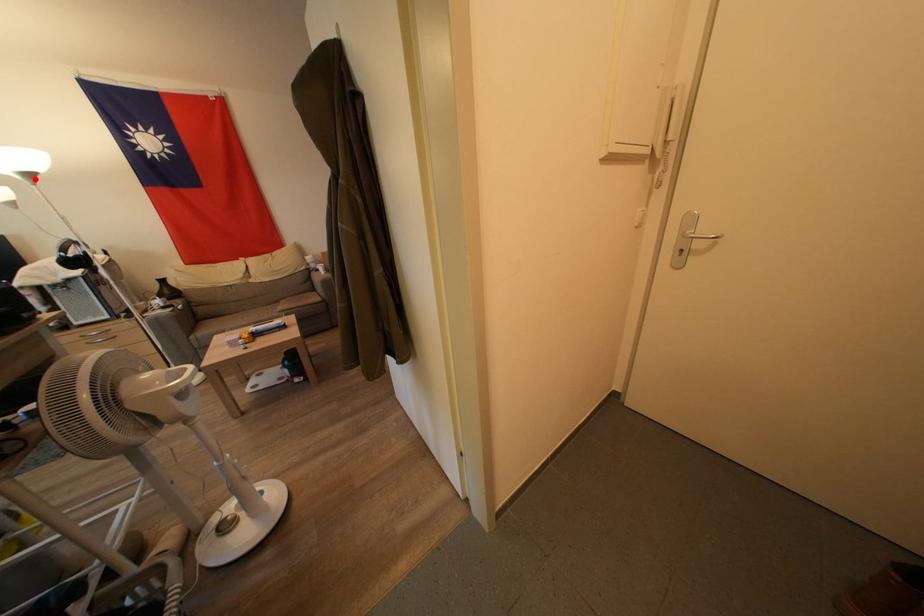
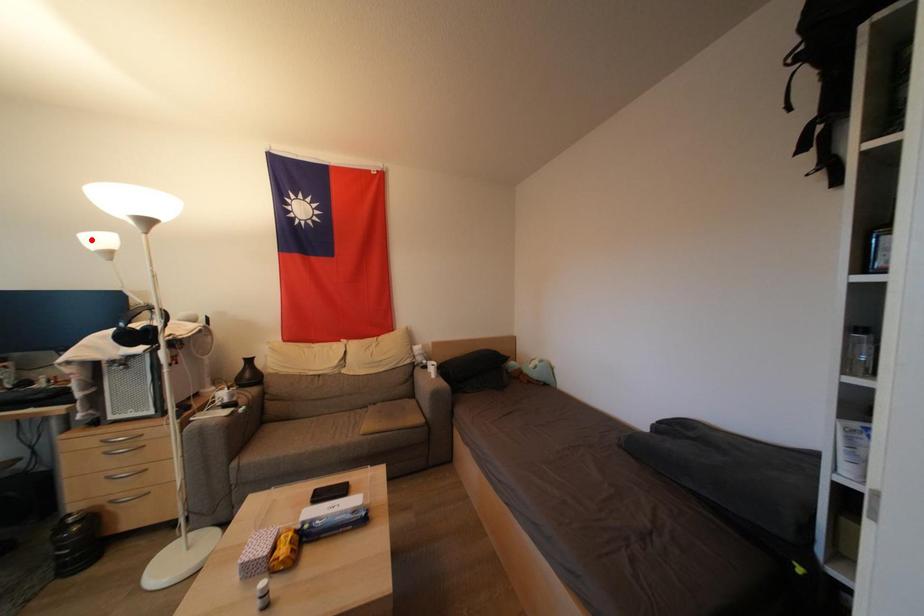
I am providing you with two images of the same scene from different viewpoints. A red point is marked on the first image and another point is marked on the second image. Is the marked point in image1 the same physical position as the marked point in image2?

No